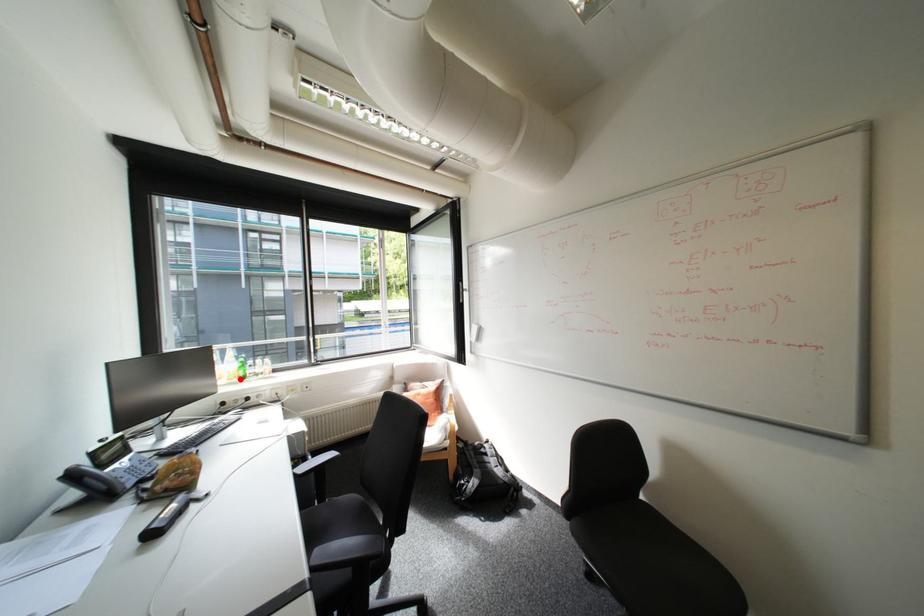
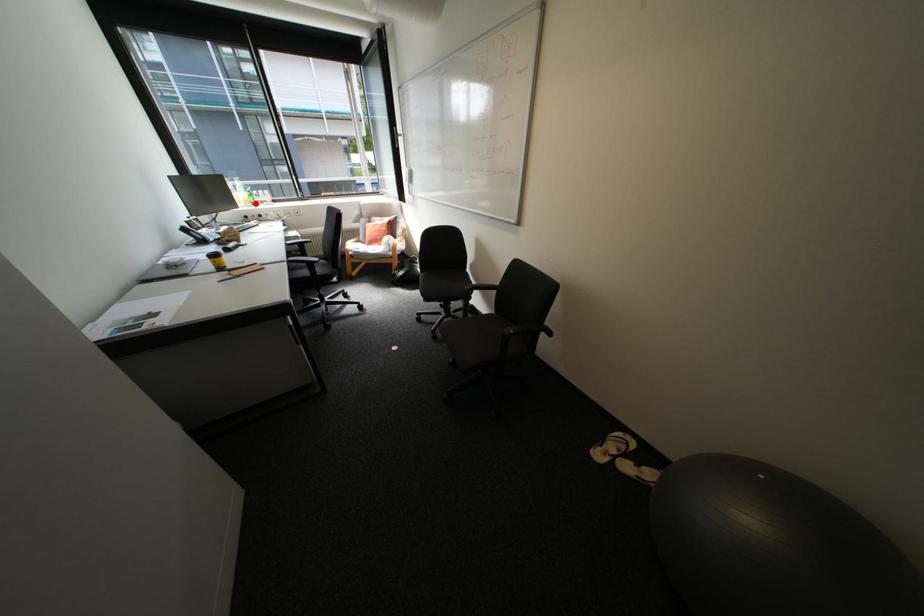
I am providing you with two images of the same scene from different viewpoints. A red point is marked on the first image and another point is marked on the second image. Do the highlighted points in image1 and image2 indicate the same real-world spot?

Yes